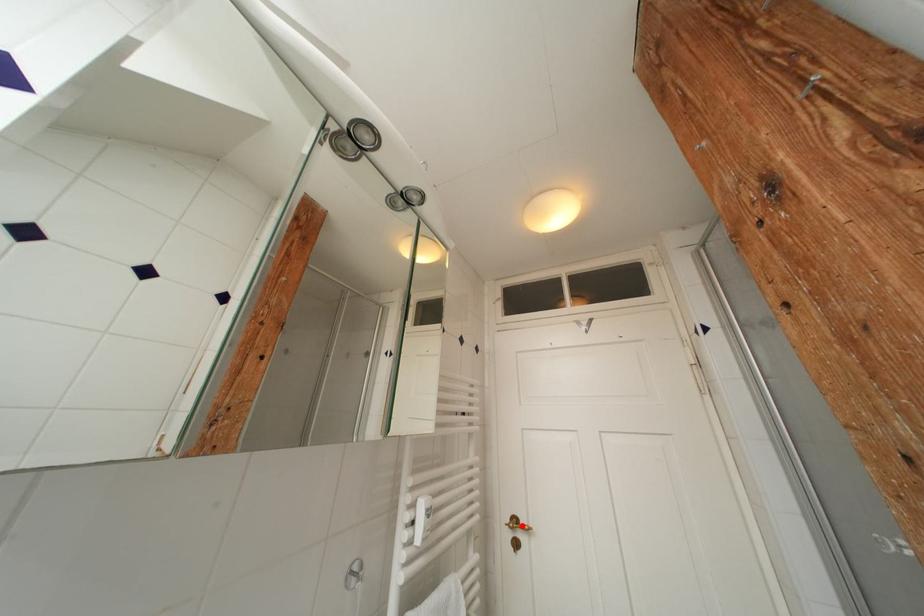
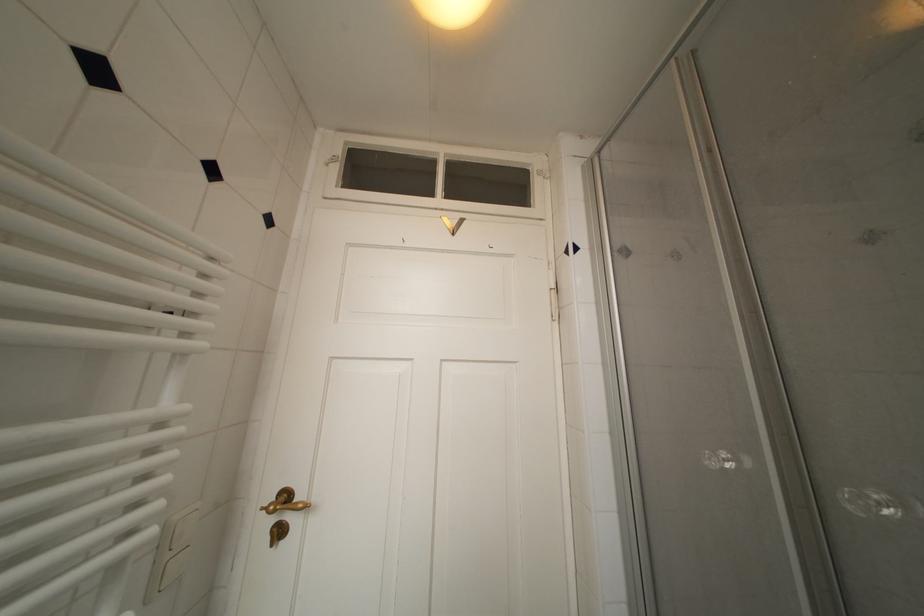
Locate, in the second image, the point that corresponds to the highlighted location in the first image.

(293, 500)